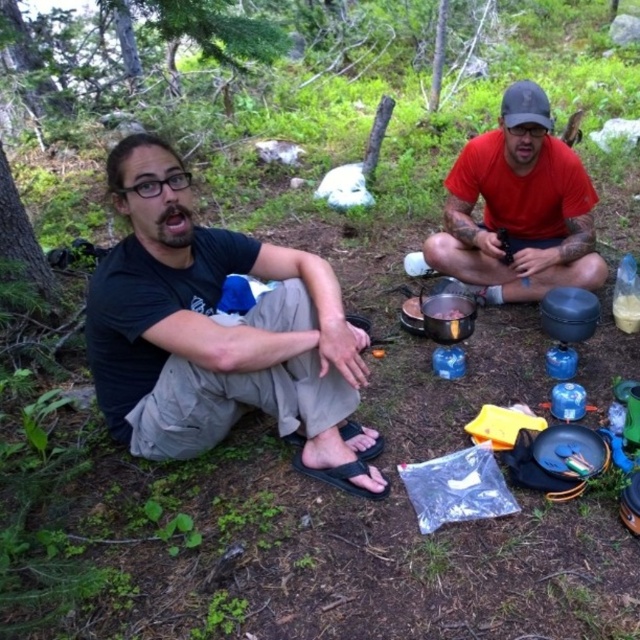
Can you confirm if black matte shirt at left is positioned below red matte shirt at center?

Yes, black matte shirt at left is below red matte shirt at center.

Measure the distance between black matte shirt at left and red matte shirt at center.

black matte shirt at left and red matte shirt at center are 1.23 meters apart.

You are a GUI agent. You are given a task and a screenshot of the screen. Output one action in this format:
    pyautogui.click(x=<x>, y=<y>)
    Task: Click on the black matte shirt at left
    Image resolution: width=640 pixels, height=640 pixels.
    Given the screenshot: What is the action you would take?
    pyautogui.click(x=218, y=332)

Where is `black matte shirt at left`? black matte shirt at left is located at coordinates (218, 332).